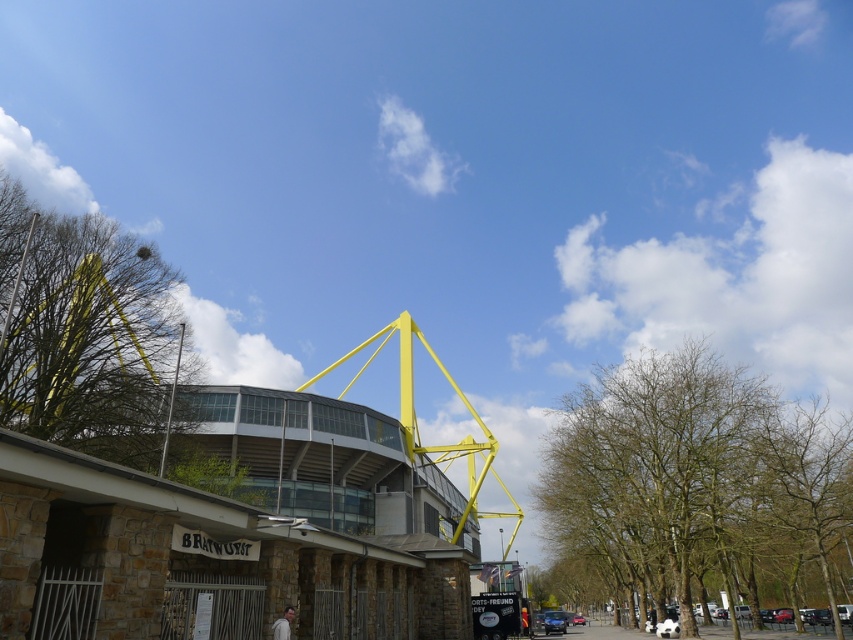
You are an architect reviewing the design of the stadium. You notice the yellow metallic structure at center and the bare branches at center. Which object takes up more space in the image?

The bare branches at center take up more space than the yellow metallic structure at center.

You are a drone operator trying to capture a photo of the yellow metallic structure at center without any obstructions. Considering the green leafy tree at upper left, is there a risk of the tree blocking the view of the structure?

The yellow metallic structure at center is positioned under the green leafy tree at upper left, so the tree may block the view of the structure from above. Adjust the drone angle or position to avoid the tree branches.

In the scene shown: You are an architect analyzing the image of the stadium. Based on the scene, can you determine if the yellow metallic structure at center is wider than the green leafy tree at upper left?

The yellow metallic structure at center might be wider than green leafy tree at upper left according to the description.